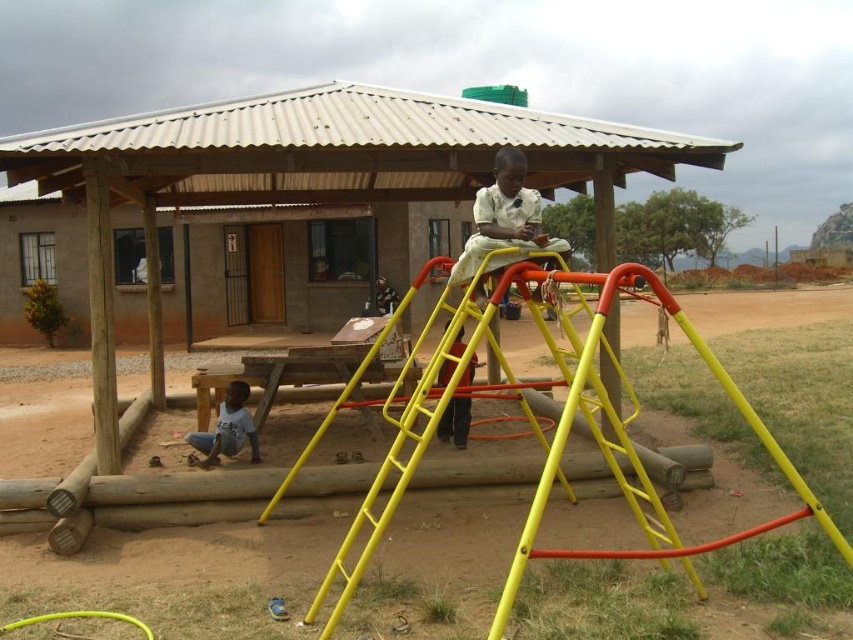
You are a parent trying to ensure safety at the playground. You notice the yellow metal ladder at center and the light blue cotton shirt at lower left. Which object is shorter?

The yellow metal ladder at center is shorter than the light blue cotton shirt at lower left.

You are a parent at the playground and see two children wearing the white cotton shirt at center and the light blue cotton shirt at lower left. Which child is wearing a bigger shirt?

The child wearing the white cotton shirt at center is wearing a bigger shirt because the white cotton shirt at center is larger in size than the light blue cotton shirt at lower left.